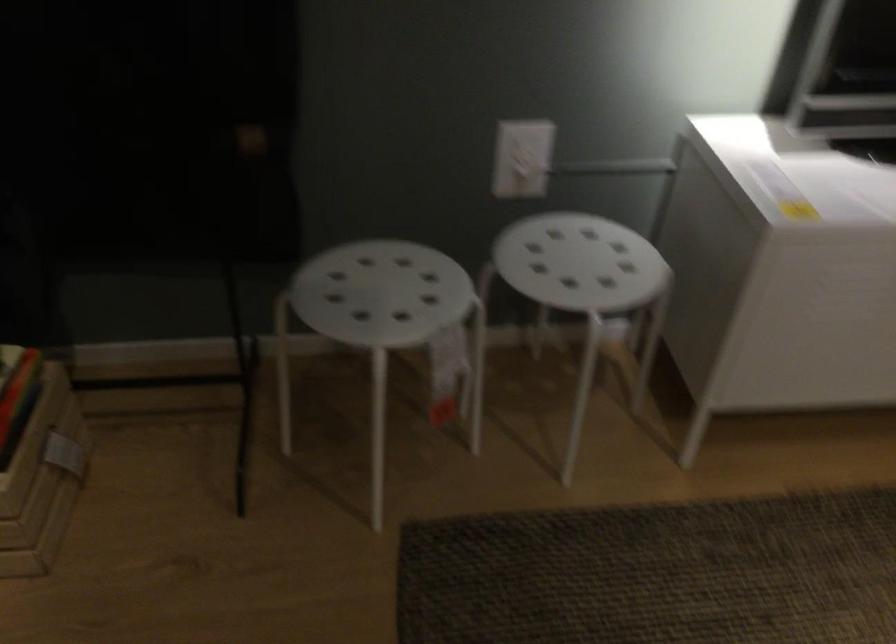
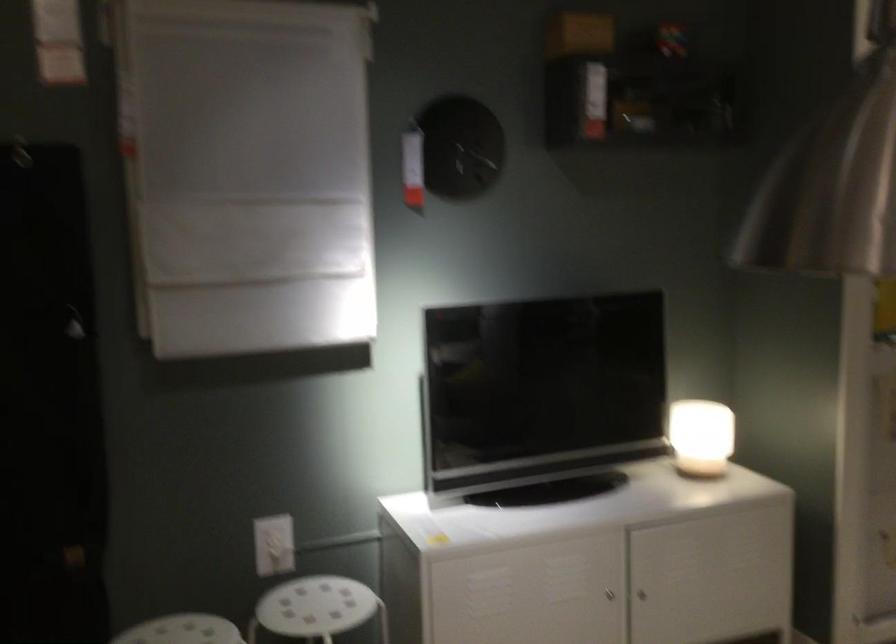
The point at [574,256] is marked in the first image. Where is the corresponding point in the second image?

(315, 607)